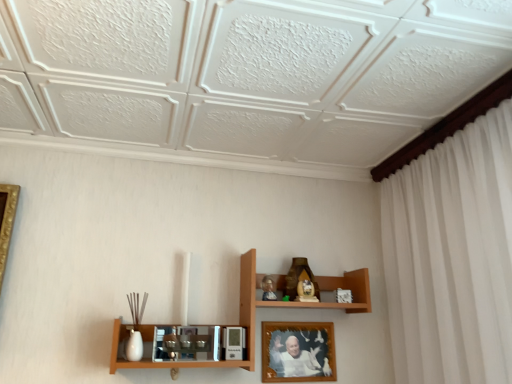
Question: Is wooden photo frame at center to the left or to the right of matte brown statue at upper center in the image?

Choices:
 (A) right
 (B) left

Answer: (B)

Question: From the image's perspective, is wooden photo frame at center located above or below matte brown statue at upper center?

Choices:
 (A) below
 (B) above

Answer: (A)

Question: Considering the real-world distances, which object is farthest from the wooden photo frame at center?

Choices:
 (A) wooden shelf at center
 (B) matte brown statue at upper center

Answer: (B)

Question: Which object is the closest to the wooden shelf at center?

Choices:
 (A) wooden photo frame at center
 (B) matte brown statue at upper center

Answer: (A)